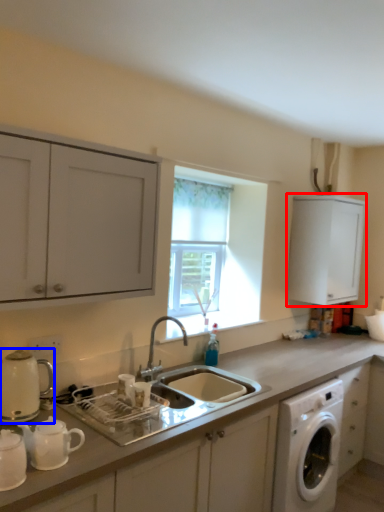
Question: Among these objects, which one is farthest to the camera, cabinetry (highlighted by a red box) or appliance (highlighted by a blue box)?

Choices:
 (A) cabinetry
 (B) appliance

Answer: (A)